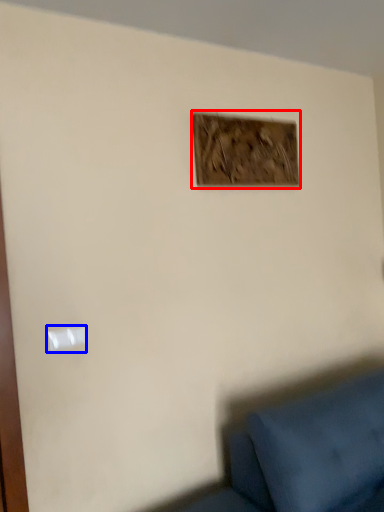
Question: Which point is closer to the camera, picture frame (highlighted by a red box) or light switch (highlighted by a blue box)?

Choices:
 (A) picture frame
 (B) light switch

Answer: (B)